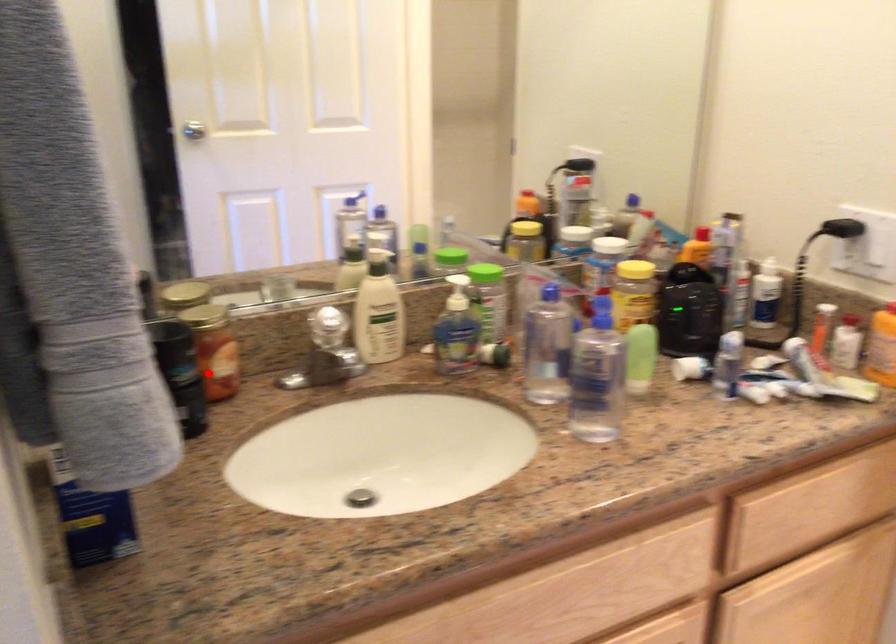
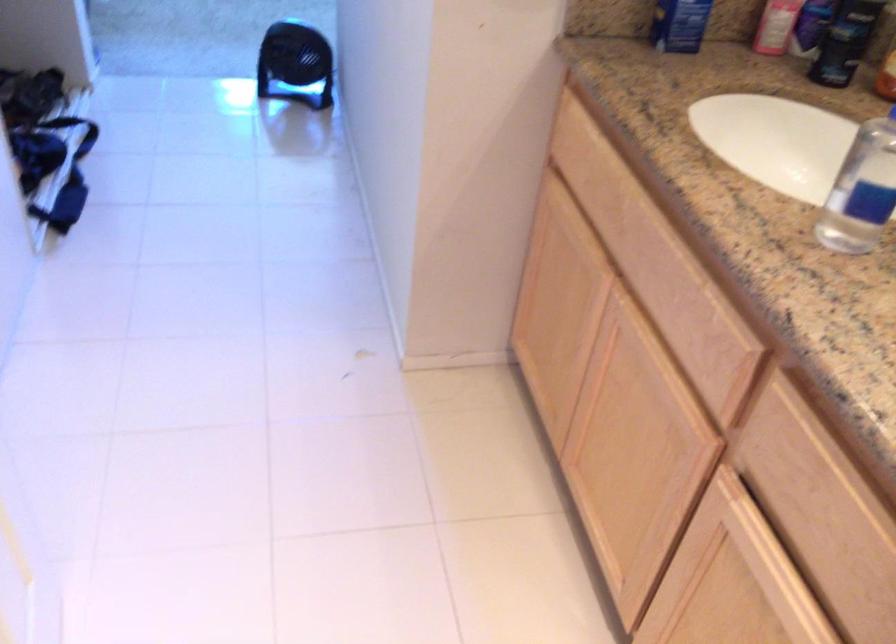
The point at the highlighted location is marked in the first image. Where is the corresponding point in the second image?

(845, 41)